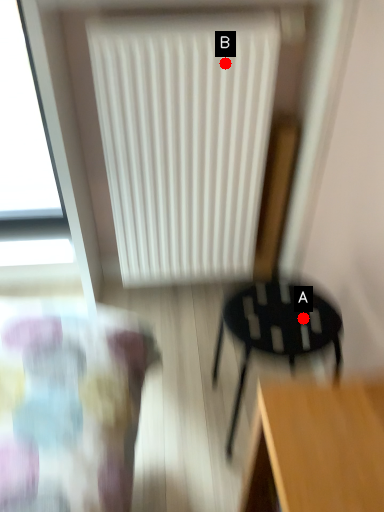
Question: Two points are circled on the image, labeled by A and B beside each circle. Which point is further to the camera?

Choices:
 (A) A is further
 (B) B is further

Answer: (B)